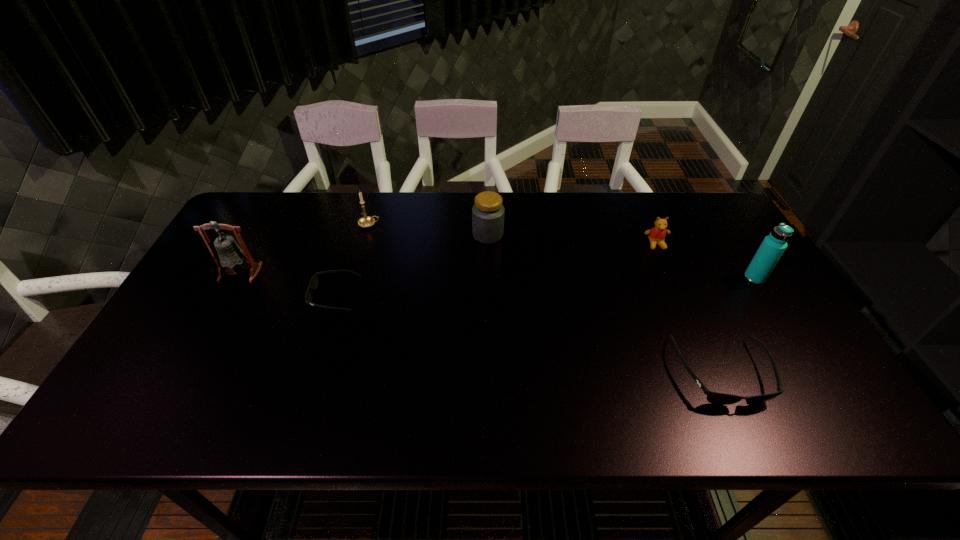
The width and height of the screenshot is (960, 540). Find the location of `free region at the far left corner`. free region at the far left corner is located at coordinates (249, 226).

Locate an element on the screen. The width and height of the screenshot is (960, 540). free space at the near left corner of the desktop is located at coordinates (150, 371).

At what (x,y) coordinates should I click in order to perform the action: click on free spot at the far right corner of the desktop. Please return your answer as a coordinate pair (x, y). Looking at the image, I should click on (725, 219).

Locate an element on the screen. unoccupied area between the candle holder and the rightmost object is located at coordinates (562, 251).

At what (x,y) coordinates should I click in order to perform the action: click on free spot between the candle holder and the bell. Please return your answer as a coordinate pair (x, y). Looking at the image, I should click on (305, 248).

This screenshot has width=960, height=540. Identify the location of empty space between the candle holder and the left sunglasses. (351, 260).

Find the location of a particular element. The width and height of the screenshot is (960, 540). vacant area that lies between the shorter sunglasses and the teddy bear is located at coordinates (495, 270).

Where is `free point between the teddy bear and the rightmost object`? The image size is (960, 540). free point between the teddy bear and the rightmost object is located at coordinates (706, 261).

You are a GUI agent. You are given a task and a screenshot of the screen. Output one action in this format:
    pyautogui.click(x=<x>, y=<y>)
    Task: Click on the vacant point located between the candle holder and the jar
    The height and width of the screenshot is (540, 960).
    Given the screenshot: What is the action you would take?
    pyautogui.click(x=429, y=230)

Where is `empty space that is in between the candle holder and the leftmost object`? empty space that is in between the candle holder and the leftmost object is located at coordinates (305, 248).